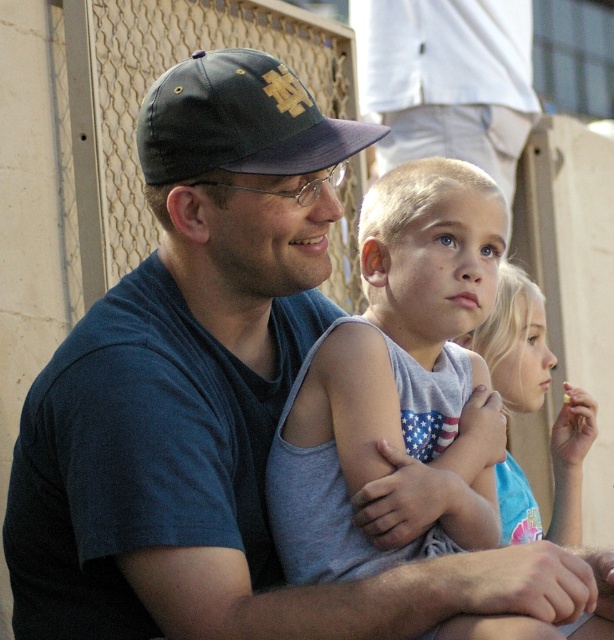
Which is below, dark blue fabric baseball cap at upper left or light blue tank top at center?

light blue tank top at center is below.

Is dark blue fabric baseball cap at upper left shorter than light blue tank top at center?

Yes.

The height and width of the screenshot is (640, 614). Describe the element at coordinates (238, 120) in the screenshot. I see `dark blue fabric baseball cap at upper left` at that location.

This screenshot has height=640, width=614. What are the coordinates of `dark blue fabric baseball cap at upper left` in the screenshot? It's located at (238, 120).